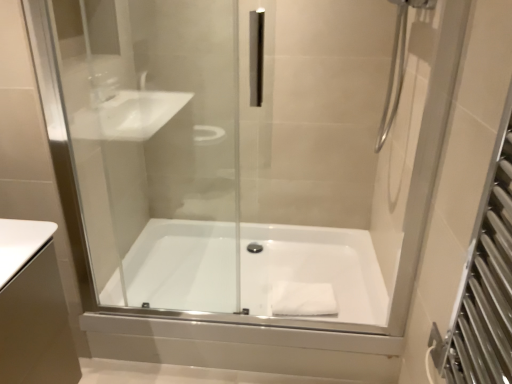
Describe the element at coordinates (303, 299) in the screenshot. The height and width of the screenshot is (384, 512). I see `white fabric at bottom` at that location.

Where is `white fabric at bottom`? Image resolution: width=512 pixels, height=384 pixels. white fabric at bottom is located at coordinates (303, 299).

The width and height of the screenshot is (512, 384). Identify the location of white glossy bathtub at center. (313, 270).

This screenshot has height=384, width=512. Describe the element at coordinates (313, 270) in the screenshot. I see `white glossy bathtub at center` at that location.

Find the location of a particular element. white fabric at bottom is located at coordinates (303, 299).

Would you say white glossy bathtub at center is to the left or to the right of white fabric at bottom in the picture?

Clearly, white glossy bathtub at center is on the left of white fabric at bottom in the image.

Which object is more forward, white glossy bathtub at center or white fabric at bottom?

white glossy bathtub at center is more forward.

Considering the positions of points (177, 309) and (305, 303), is point (177, 309) closer to camera compared to point (305, 303)?

Yes, point (177, 309) is in front of point (305, 303).

From the image's perspective, is white glossy bathtub at center on top of white fabric at bottom?

Correct, white glossy bathtub at center appears higher than white fabric at bottom in the image.

From a real-world perspective, is white glossy bathtub at center located beneath white fabric at bottom?

Yes, from a real-world perspective, white glossy bathtub at center is below white fabric at bottom.

Considering the sizes of objects white glossy bathtub at center and white fabric at bottom in the image provided, who is thinner, white glossy bathtub at center or white fabric at bottom?

white fabric at bottom.

Is white glossy bathtub at center taller than white fabric at bottom?

Indeed, white glossy bathtub at center has a greater height compared to white fabric at bottom.

Between white glossy bathtub at center and white fabric at bottom, which one has larger size?

white glossy bathtub at center.

Is white fabric at bottom surrounded by white glossy bathtub at center?

Yes, white fabric at bottom is a part of white glossy bathtub at center.

Is white glossy bathtub at center next to white fabric at bottom?

They are not placed beside each other.

Is white fabric at bottom at the back of white glossy bathtub at center?

No, white glossy bathtub at center's orientation is not away from white fabric at bottom.

Locate an element on the screen. The height and width of the screenshot is (384, 512). material lying on the right of white glossy bathtub at center is located at coordinates (303, 299).

Considering the positions of objects white fabric at bottom and white glossy bathtub at center in the image provided, who is more to the left, white fabric at bottom or white glossy bathtub at center?

white glossy bathtub at center.

Considering the positions of objects white fabric at bottom and white glossy bathtub at center in the image provided, who is in front, white fabric at bottom or white glossy bathtub at center?

white glossy bathtub at center is more forward.

Does point (323, 303) come in front of point (270, 245)?

That is True.

From the image's perspective, is white fabric at bottom located above white glossy bathtub at center?

No.

From a real-world perspective, is white fabric at bottom located higher than white glossy bathtub at center?

Correct, in the physical world, white fabric at bottom is higher than white glossy bathtub at center.

Can you confirm if white fabric at bottom is thinner than white glossy bathtub at center?

Correct, the width of white fabric at bottom is less than that of white glossy bathtub at center.

Does white fabric at bottom have a lesser height compared to white glossy bathtub at center?

Yes, white fabric at bottom is shorter than white glossy bathtub at center.

Between white fabric at bottom and white glossy bathtub at center, which one has smaller size?

With smaller size is white fabric at bottom.

Looking at this image, can we say white fabric at bottom lies outside white glossy bathtub at center?

→ No, most part of white fabric at bottom lies within white glossy bathtub at center.

Does white fabric at bottom touch white glossy bathtub at center?

white fabric at bottom and white glossy bathtub at center are clearly separated.

Could you tell me if white fabric at bottom is turned towards white glossy bathtub at center?

Yes, white fabric at bottom is facing white glossy bathtub at center.

How many degrees apart are the facing directions of white fabric at bottom and white glossy bathtub at center?

There is a 4.45-degree angle between the facing directions of white fabric at bottom and white glossy bathtub at center.

Image resolution: width=512 pixels, height=384 pixels. In order to click on bathtub in front of the white fabric at bottom in this screenshot , I will do `click(313, 270)`.

Locate an element on the screen. material behind the white glossy bathtub at center is located at coordinates (303, 299).

In the image, there is a white fabric at bottom. In order to click on bathtub above it (from the image's perspective) in this screenshot , I will do `click(313, 270)`.